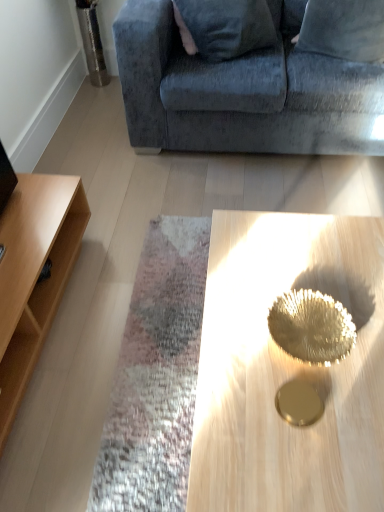
Question: From the image's perspective, is light wood shelf at left above or below gold metallic tray at center?

Choices:
 (A) below
 (B) above

Answer: (B)

Question: In terms of width, does light wood shelf at left look wider or thinner when compared to gold metallic tray at center?

Choices:
 (A) thin
 (B) wide

Answer: (A)

Question: Estimate the real-world distances between objects in this image. Which object is farther from the velvet blue pillow at upper right?

Choices:
 (A) light wood shelf at left
 (B) gold metallic tray at center
 (C) velvet blue couch at upper center

Answer: (A)

Question: Which object is positioned farthest from the gold metallic tray at center?

Choices:
 (A) velvet blue couch at upper center
 (B) light wood shelf at left
 (C) velvet blue pillow at upper right

Answer: (C)